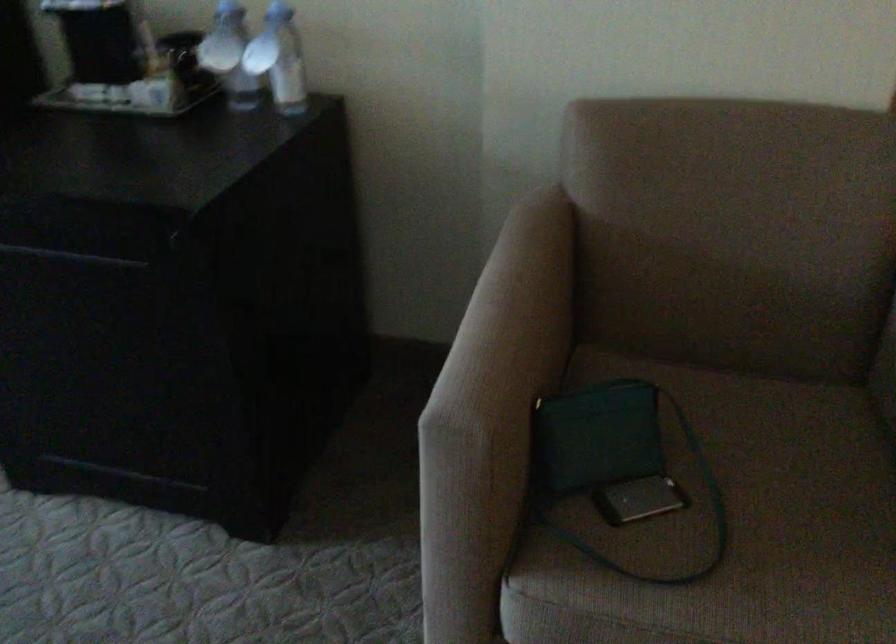
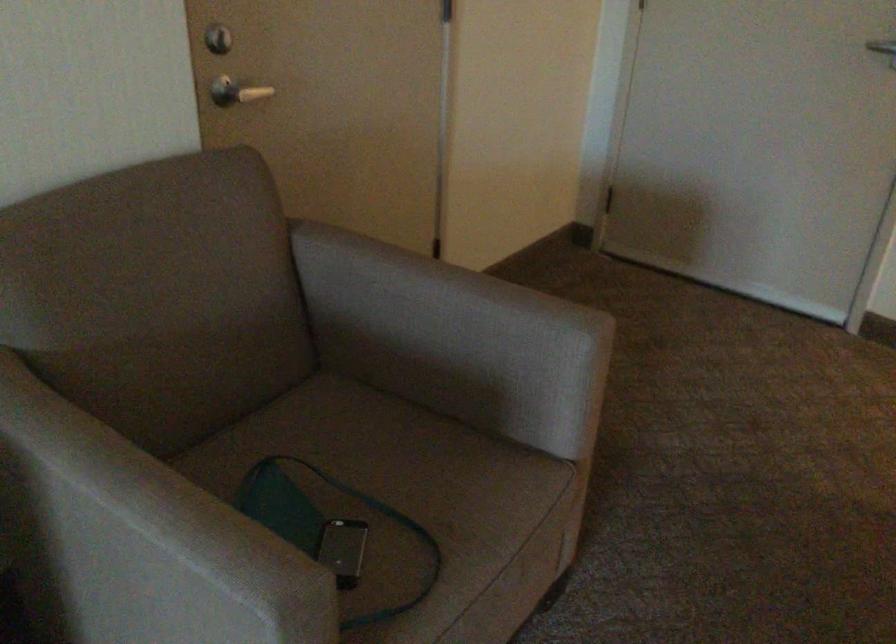
Where in the second image is the point corresponding to (x=460, y=335) from the first image?

(150, 538)